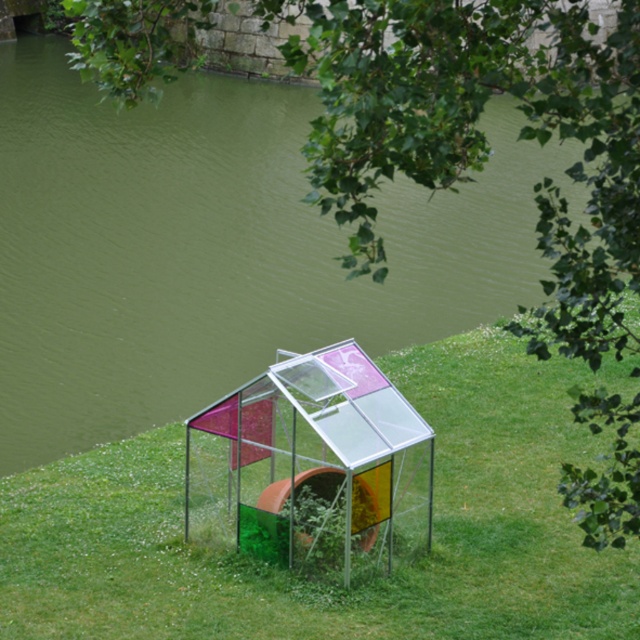
Is green grass at center in front of transparent plastic greenhouse at center?

No, it is not.

Is green grass at center above transparent plastic greenhouse at center?

Incorrect, green grass at center is not positioned above transparent plastic greenhouse at center.

Between point (269, 588) and point (369, 433), which one is positioned in front?

Positioned in front is point (269, 588).

Where is `green grass at center`? This screenshot has height=640, width=640. green grass at center is located at coordinates (320, 582).